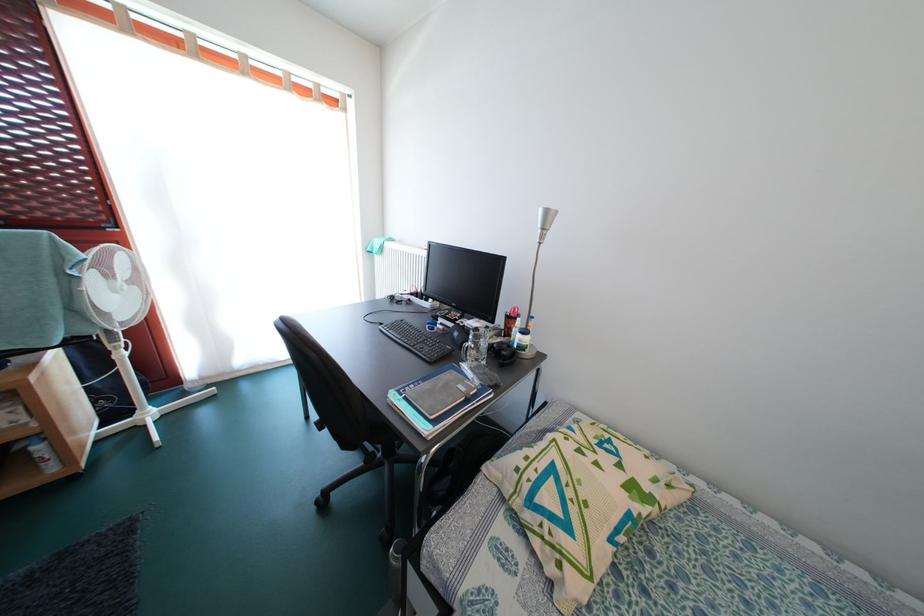
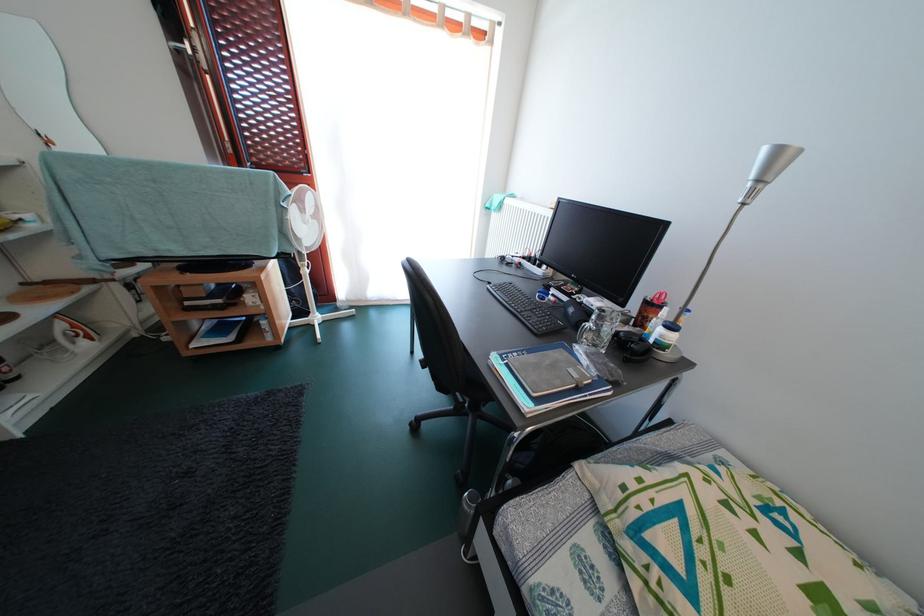
Question: The first image is from the beginning of the video and the second image is from the end. How did the camera likely rotate when shooting the video?

Choices:
 (A) Left
 (B) Right
 (C) Up
 (D) Down

Answer: (A)